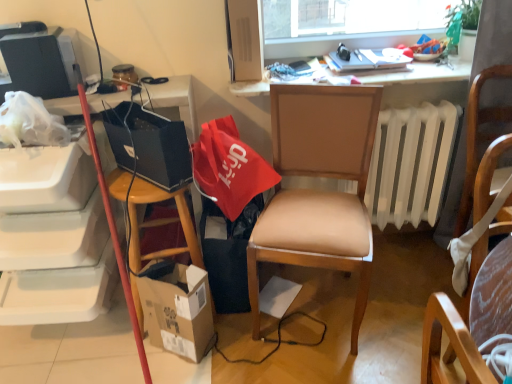
This screenshot has height=384, width=512. Find the location of `free area below white plastic radiator at center right (from a real-world perspective)`. free area below white plastic radiator at center right (from a real-world perspective) is located at coordinates (399, 238).